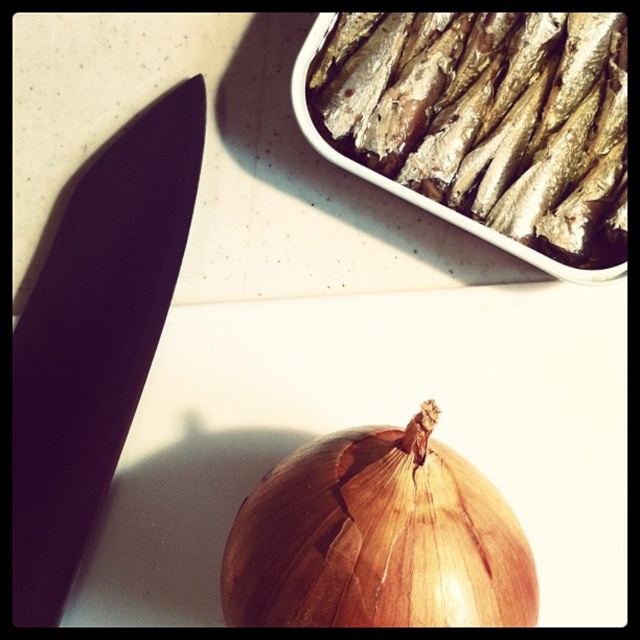
Who is positioned more to the right, shiny silver fish at upper right or brown matte onion at bottom center?

shiny silver fish at upper right

From the picture: Can you confirm if shiny silver fish at upper right is thinner than brown matte onion at bottom center?

No.

Does point (413, 76) lie behind point (348, 474)?

Yes, point (413, 76) is behind point (348, 474).

You are a GUI agent. You are given a task and a screenshot of the screen. Output one action in this format:
    pyautogui.click(x=<x>, y=<y>)
    Task: Click on the shiny silver fish at upper right
    
    Given the screenshot: What is the action you would take?
    pyautogui.click(x=484, y=124)